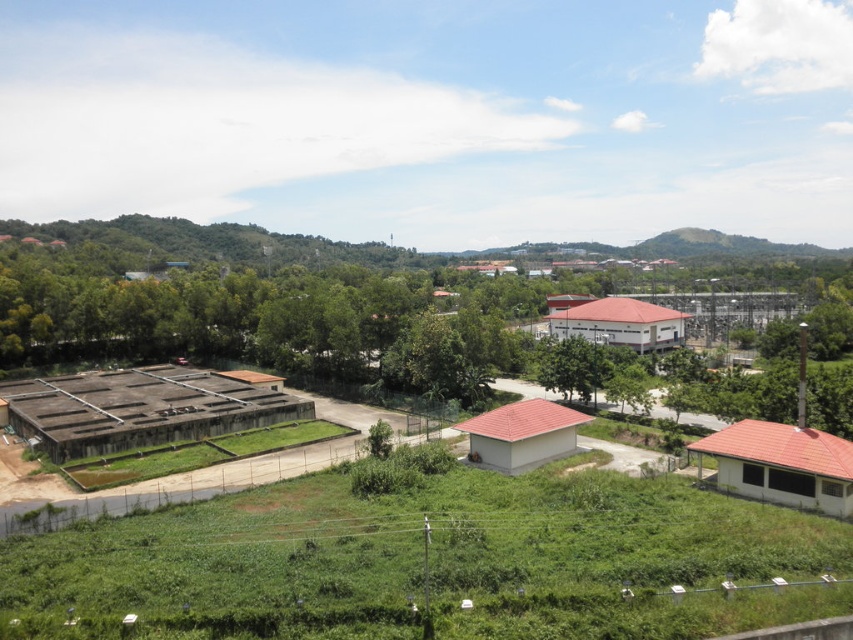
Identify the location of green leafy tree at center. (379, 316).

Is the position of green leafy tree at center less distant than that of green grassy hillside at center?

That is True.

At what (x,y) coordinates should I click in order to perform the action: click on green leafy tree at center. Please return your answer as a coordinate pair (x, y). This screenshot has height=640, width=853. Looking at the image, I should click on (379, 316).